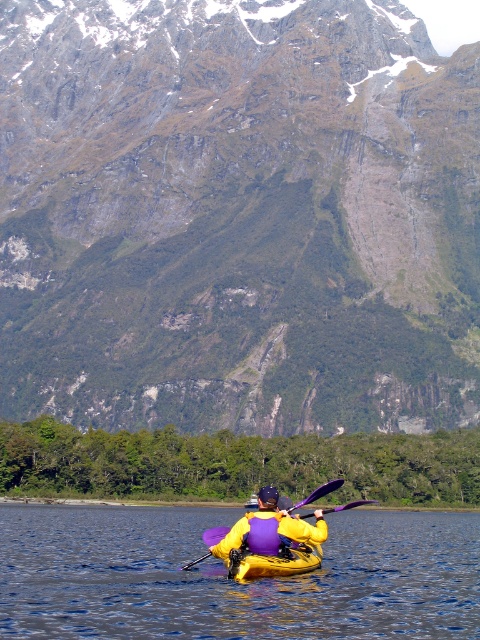
Does green rock at upper center appear over blue water at center?

Indeed, green rock at upper center is positioned over blue water at center.

Who is positioned more to the right, green rock at upper center or blue water at center?

Positioned to the right is blue water at center.

In the scene shown: Measure the distance between green rock at upper center and camera.

They are 563.93 meters apart.

Identify the location of green rock at upper center. (237, 216).

Who is higher up, blue water at center or yellow fabric kayak at center?

yellow fabric kayak at center

Between point (407, 536) and point (248, 540), which one is positioned behind?

The point (407, 536) is more distant.

I want to click on blue water at center, so click(230, 579).

Who is taller, green rock at upper center or yellow fabric kayak at center?

green rock at upper center

Consider the image. Does green rock at upper center appear over yellow fabric kayak at center?

Yes, green rock at upper center is above yellow fabric kayak at center.

Is point (474, 204) more distant than point (230, 552)?

Yes, point (474, 204) is farther from viewer.

Identify the location of green rock at upper center. This screenshot has height=640, width=480. (237, 216).